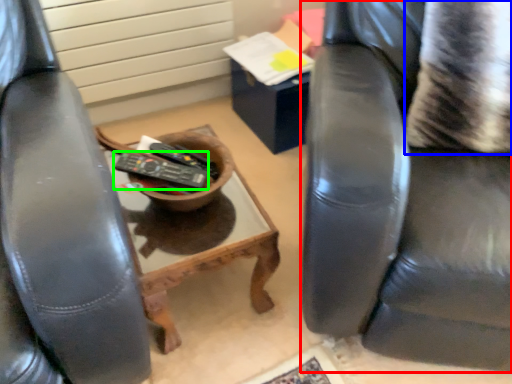
Question: Based on their relative distances, which object is nearer to chair (highlighted by a red box)? Choose from pillow (highlighted by a blue box) and remote control (highlighted by a green box).

Choices:
 (A) pillow
 (B) remote control

Answer: (A)